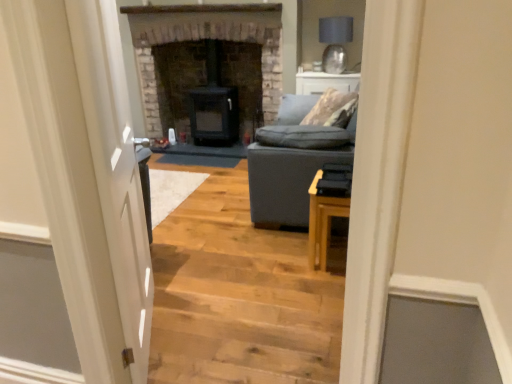
Question: From a real-world perspective, is black matte wood stove at center, which ranks as the 1th fireplace in right-to-left order, physically located above or below white glossy door at left?

Choices:
 (A) above
 (B) below

Answer: (B)

Question: In terms of height, does black matte wood stove at center, which appears as the 2th fireplace when viewed from the left, look taller or shorter compared to white glossy door at left?

Choices:
 (A) tall
 (B) short

Answer: (B)

Question: Which of these objects is positioned closest to the matte gray lampshade at upper right?

Choices:
 (A) light wood stairwell at center
 (B) dark gray fabric couch at center
 (C) dark gray stone fireplace at center, arranged as the 1th fireplace when viewed from the left
 (D) light wood table at right
 (E) white glossy door at left

Answer: (C)

Question: Which is farther from the black matte wood stove at center, which appears as the 2th fireplace when viewed from the left?

Choices:
 (A) white glossy door at left
 (B) dark gray fabric couch at center
 (C) light wood stairwell at center
 (D) dark gray stone fireplace at center, positioned as the 2th fireplace in right-to-left order
 (E) matte gray lampshade at upper right

Answer: (A)